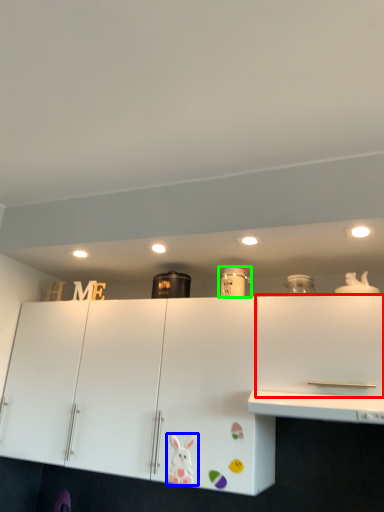
Question: Which is nearer to the cabinetry (highlighted by a red box)? animal (highlighted by a blue box) or appliance (highlighted by a green box).

Choices:
 (A) animal
 (B) appliance

Answer: (B)